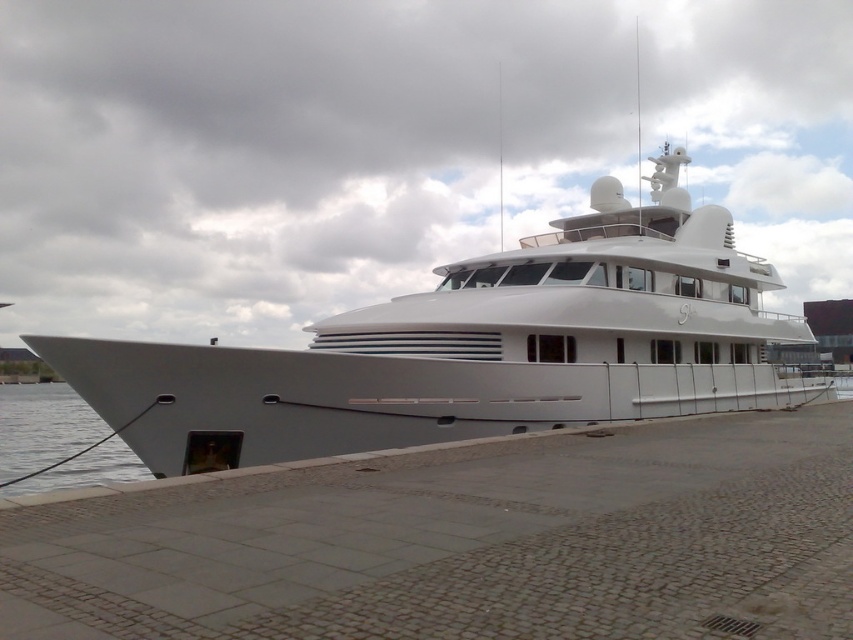
Describe the element at coordinates (474, 348) in the screenshot. I see `white glossy yacht at center` at that location.

Is point (334, 380) farther from camera compared to point (71, 456)?

No, it is not.

Is point (732, 232) behind point (90, 445)?

That is False.

Image resolution: width=853 pixels, height=640 pixels. Identify the location of white glossy yacht at center. (474, 348).